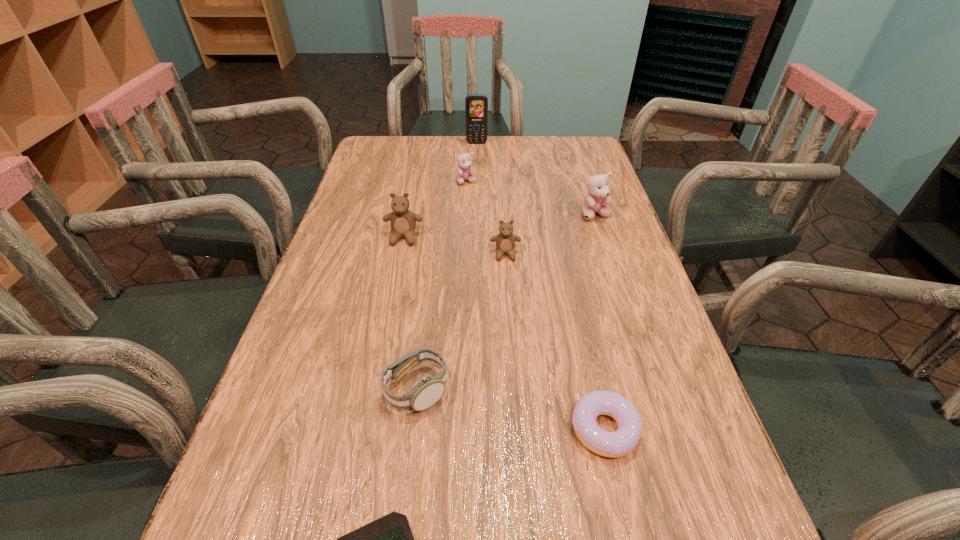
Identify the location of free space that satisfies the following two spatial constraints: 1. on the face of the seventh tallest object; 2. on the right side of the white watch. The image size is (960, 540). (412, 429).

This screenshot has width=960, height=540. Find the location of `vacant position in the image that satisfies the following two spatial constraints: 1. on the screen of the seventh tallest object; 2. on the right side of the cellular telephone`. vacant position in the image that satisfies the following two spatial constraints: 1. on the screen of the seventh tallest object; 2. on the right side of the cellular telephone is located at coordinates (473, 429).

This screenshot has height=540, width=960. In order to click on free space that satisfies the following two spatial constraints: 1. on the back side of the second object from right to left; 2. on the face of the sixth tallest object in this screenshot , I will do [x=596, y=390].